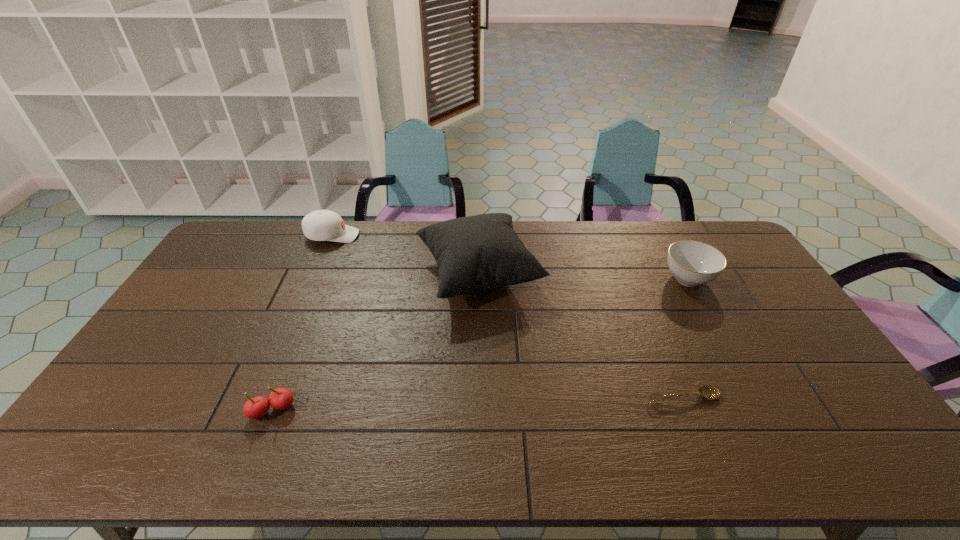
You are a GUI agent. You are given a task and a screenshot of the screen. Output one action in this format:
    pyautogui.click(x=<x>, y=<y>)
    Task: Click on the vacant space situated on the front of the shortest object
    The width and height of the screenshot is (960, 540).
    Given the screenshot: What is the action you would take?
    pyautogui.click(x=703, y=446)

Locate an element on the screen. The image size is (960, 540). cushion at the far edge is located at coordinates (476, 253).

Where is `baseball cap that is at the far edge`? baseball cap that is at the far edge is located at coordinates (322, 225).

At what (x,y) coordinates should I click in order to perform the action: click on object at the right edge. Please return your answer as a coordinate pair (x, y). Looking at the image, I should click on 692,263.

In the image, there is a desktop. Where is `vacant space at the far edge`? vacant space at the far edge is located at coordinates (614, 236).

At what (x,y) coordinates should I click in order to perform the action: click on vacant space at the near edge of the desktop. Please return your answer as a coordinate pair (x, y). Looking at the image, I should click on (453, 446).

At what (x,y) coordinates should I click in order to perform the action: click on vacant space at the left edge of the desktop. Please return your answer as a coordinate pair (x, y). This screenshot has height=540, width=960. Looking at the image, I should click on (235, 291).

Where is `vacant space at the right edge`? vacant space at the right edge is located at coordinates (771, 300).

Image resolution: width=960 pixels, height=540 pixels. In order to click on vacant area at the near right corner of the desktop in this screenshot , I will do `click(841, 468)`.

The height and width of the screenshot is (540, 960). In order to click on free point between the chinaware and the cherry in this screenshot , I will do coord(480,345).